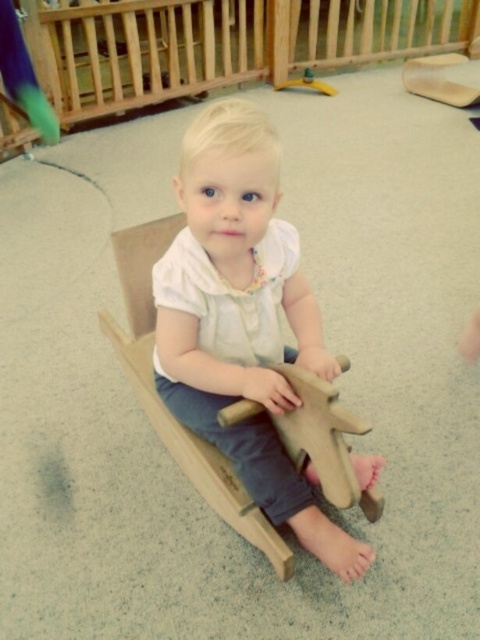
Can you confirm if wooden rocking horse at center is positioned above wooden horse at center?

No, wooden rocking horse at center is not above wooden horse at center.

Describe the element at coordinates (242, 317) in the screenshot. I see `wooden rocking horse at center` at that location.

Where is `wooden rocking horse at center`? This screenshot has width=480, height=640. wooden rocking horse at center is located at coordinates (242, 317).